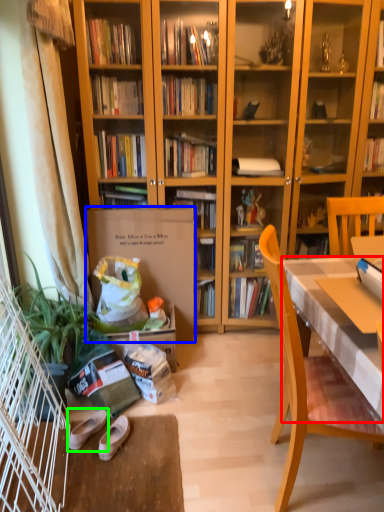
Question: Based on their relative distances, which object is nearer to desk (highlighted by a red box)? Choose from paperback book (highlighted by a blue box) and footwear (highlighted by a green box).

Choices:
 (A) paperback book
 (B) footwear

Answer: (A)